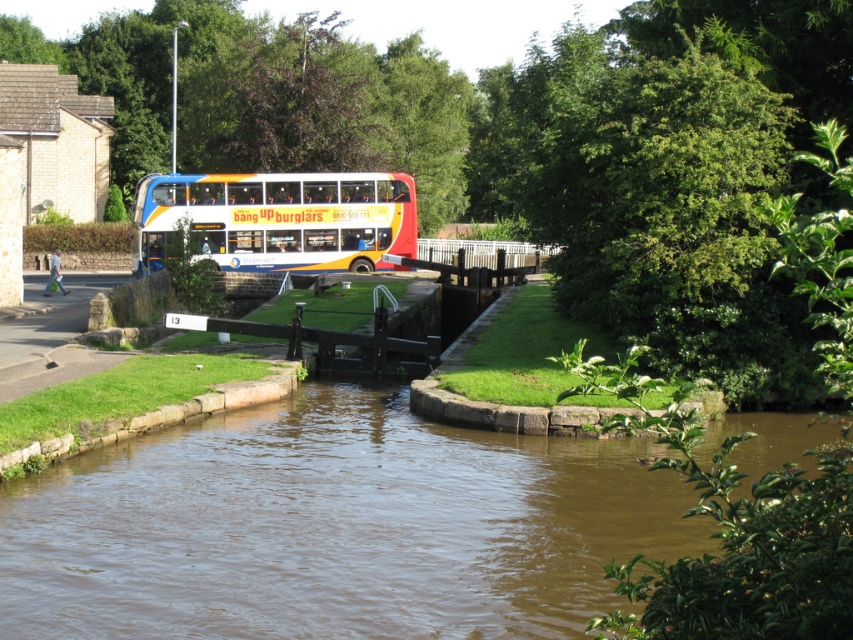
Can you confirm if brown muddy water at center is positioned to the right of white glossy double-decker bus at center?

Yes, brown muddy water at center is to the right of white glossy double-decker bus at center.

Can you confirm if brown muddy water at center is shorter than white glossy double-decker bus at center?

Indeed, brown muddy water at center has a lesser height compared to white glossy double-decker bus at center.

This screenshot has height=640, width=853. In order to click on brown muddy water at center in this screenshot , I will do `click(334, 528)`.